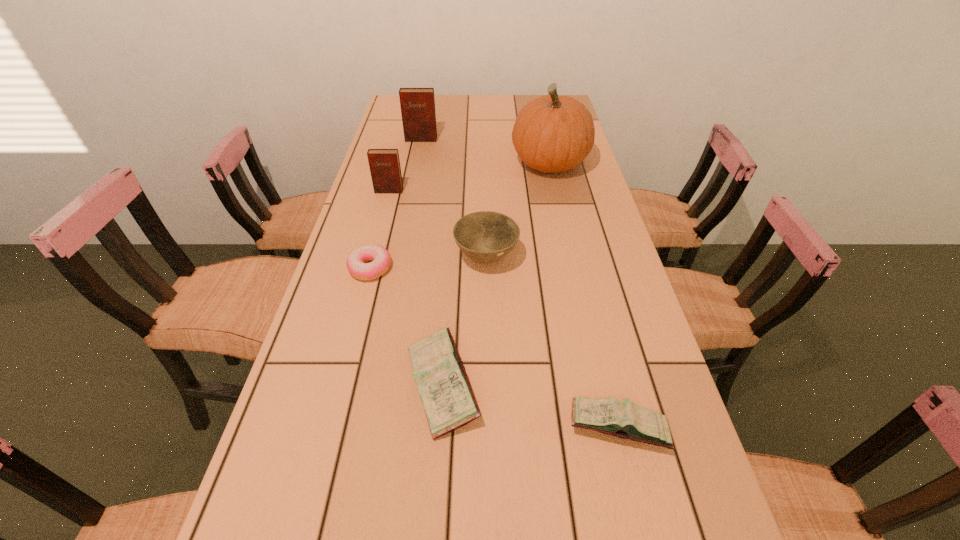
At what (x,y) coordinates should I click in order to perform the action: click on the rightmost diary. Please return your answer as a coordinate pair (x, y). Image resolution: width=960 pixels, height=540 pixels. Looking at the image, I should click on (624, 419).

What are the coordinates of `the second shortest object` in the screenshot? It's located at (624, 419).

Find the location of a particular element. The width and height of the screenshot is (960, 540). pink doughnut is located at coordinates (380, 257).

You are a GUI agent. You are given a task and a screenshot of the screen. Output one action in this format:
    pyautogui.click(x=<x>, y=<y>)
    Task: Click on the doughnut
    This screenshot has width=960, height=540.
    Given the screenshot: What is the action you would take?
    pyautogui.click(x=380, y=257)

This screenshot has width=960, height=540. In order to click on vacant space located on the stem of the second farthest object in this screenshot , I will do `click(481, 164)`.

Where is `free location located 0.310m on the stem of the second farthest object`? free location located 0.310m on the stem of the second farthest object is located at coordinates (418, 164).

The image size is (960, 540). What are the coordinates of `vacant space located 0.340m on the stem of the second farthest object` in the screenshot? It's located at (409, 164).

In order to click on free space located on the front cover of the farthest object in this screenshot , I will do `click(408, 200)`.

What are the coordinates of `vacant space located on the front cover of the second tallest diary` in the screenshot? It's located at (377, 234).

I want to click on blank space located 0.200m on the front of the gray bowl, so click(488, 346).